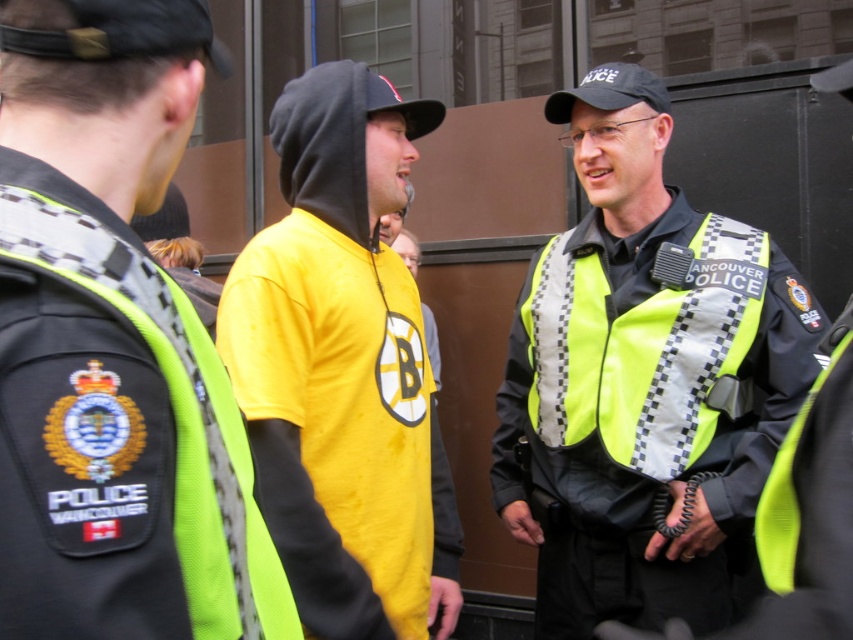
Question: Can you confirm if reflective yellow vest at center is thinner than yellow fabric shirt at center?

Choices:
 (A) yes
 (B) no

Answer: (B)

Question: Can you confirm if reflective yellow vest at center is thinner than yellow fabric shirt at center?

Choices:
 (A) no
 (B) yes

Answer: (A)

Question: Which point is farther from the camera taking this photo?

Choices:
 (A) (572, 228)
 (B) (36, 432)

Answer: (A)

Question: Based on their relative distances, which object is farther from the neon green fabric vest at center?

Choices:
 (A) reflective yellow vest at center
 (B) neon yellow reflective vest at center
 (C) yellow fabric shirt at center

Answer: (A)

Question: Does reflective yellow vest at center have a lesser width compared to yellow fabric shirt at center?

Choices:
 (A) no
 (B) yes

Answer: (A)

Question: Among these points, which one is farthest from the camera?

Choices:
 (A) (111, 440)
 (B) (788, 326)

Answer: (B)